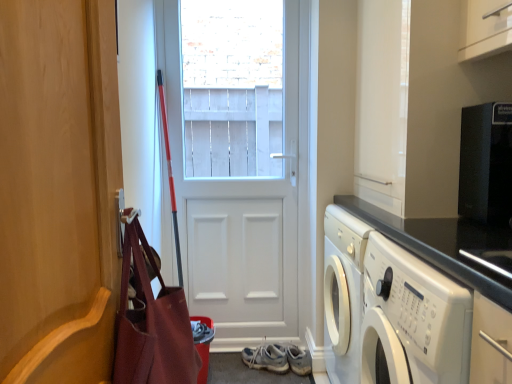
What do you see at coordinates (266, 358) in the screenshot? I see `light blue fabric sneakers at center` at bounding box center [266, 358].

What do you see at coordinates (486, 163) in the screenshot?
I see `black matte microwave at upper right` at bounding box center [486, 163].

I want to click on white glossy washing machine at lower right, so click(x=412, y=320).

Describe the element at coordinates (151, 320) in the screenshot. I see `leather-like brown bag at left` at that location.

Find the location of a particular element. The image size is (512, 384). light blue fabric sneakers at center is located at coordinates (266, 358).

Between light blue fabric sneakers at center and black matte microwave at upper right, which one has more height?

black matte microwave at upper right is taller.

Which is more to the left, light blue fabric sneakers at center or black matte microwave at upper right?

light blue fabric sneakers at center.

Which object is further away from the camera, light blue fabric sneakers at center or black matte microwave at upper right?

light blue fabric sneakers at center is further away from the camera.

Is light blue fabric sneakers at center next to black matte microwave at upper right?

light blue fabric sneakers at center is not next to black matte microwave at upper right, and they're not touching.

Is wooden door at left, placed as the 1th door when sorted from front to back, facing towards white glossy washing machine at lower right?

Yes.

Does wooden door at left, positioned as the 2th door in back-to-front order, appear on the left side of white glossy washing machine at lower right?

Indeed, wooden door at left, positioned as the 2th door in back-to-front order, is positioned on the left side of white glossy washing machine at lower right.

Is wooden door at left, positioned as the 2th door in back-to-front order, not near white glossy washing machine at lower right?

No, wooden door at left, positioned as the 2th door in back-to-front order, is not far away from white glossy washing machine at lower right.

From a real-world perspective, is leather-like brown bag at left positioned under white matte door at center, the 1th door in the back-to-front sequence, based on gravity?

Yes, from a real-world perspective, leather-like brown bag at left is below white matte door at center, the 1th door in the back-to-front sequence.

Between leather-like brown bag at left and white matte door at center, the 1th door in the back-to-front sequence, which one appears on the left side from the viewer's perspective?

Positioned to the left is leather-like brown bag at left.

From the image's perspective, which one is positioned higher, leather-like brown bag at left or white matte door at center, the 1th door in the back-to-front sequence?

white matte door at center, the 1th door in the back-to-front sequence, from the image's perspective.

Which of these two, white glossy washing machine at lower right or leather-like brown bag at left, stands taller?

Standing taller between the two is white glossy washing machine at lower right.

From the image's perspective, is white glossy washing machine at lower right located beneath leather-like brown bag at left?

Yes.

Considering the positions of point (460, 348) and point (151, 296), is point (460, 348) closer or farther from the camera than point (151, 296)?

Clearly, point (460, 348) is closer to the camera than point (151, 296).

Where is `bag positioned vertically above the white glossy washing machine at lower right (from a real-world perspective)`? bag positioned vertically above the white glossy washing machine at lower right (from a real-world perspective) is located at coordinates (151, 320).

This screenshot has width=512, height=384. Find the location of `washing machine in front of the white matte door at center, the 1th door in the back-to-front sequence`. washing machine in front of the white matte door at center, the 1th door in the back-to-front sequence is located at coordinates (412, 320).

Is white glossy washing machine at lower right smaller than white matte door at center, the 1th door in the back-to-front sequence?

Indeed, white glossy washing machine at lower right has a smaller size compared to white matte door at center, the 1th door in the back-to-front sequence.

Between white glossy washing machine at lower right and white matte door at center, acting as the 2th door starting from the front, which one has less height?

With less height is white glossy washing machine at lower right.

From the image's perspective, is white glossy washing machine at lower right below white matte door at center, acting as the 2th door starting from the front?

Correct, white glossy washing machine at lower right appears lower than white matte door at center, acting as the 2th door starting from the front, in the image.

From the image's perspective, is wooden door at left, placed as the 1th door when sorted from front to back, positioned above or below leather-like brown bag at left?

wooden door at left, placed as the 1th door when sorted from front to back, is above leather-like brown bag at left.

Can you confirm if wooden door at left, positioned as the 2th door in back-to-front order, is positioned to the right of leather-like brown bag at left?

No, wooden door at left, positioned as the 2th door in back-to-front order, is not to the right of leather-like brown bag at left.

Is wooden door at left, positioned as the 2th door in back-to-front order, turned away from leather-like brown bag at left?

No, wooden door at left, positioned as the 2th door in back-to-front order,'s orientation is not away from leather-like brown bag at left.

Considering the sizes of leather-like brown bag at left and black matte microwave at upper right in the image, is leather-like brown bag at left bigger or smaller than black matte microwave at upper right?

Considering their sizes, leather-like brown bag at left takes up more space than black matte microwave at upper right.

Between leather-like brown bag at left and black matte microwave at upper right, which one has smaller width?

leather-like brown bag at left.

Considering the relative positions of leather-like brown bag at left and black matte microwave at upper right in the image provided, is leather-like brown bag at left to the right of black matte microwave at upper right from the viewer's perspective?

Incorrect, leather-like brown bag at left is not on the right side of black matte microwave at upper right.

How many degrees apart are the facing directions of leather-like brown bag at left and black matte microwave at upper right?

The angular difference between leather-like brown bag at left and black matte microwave at upper right is 179 degrees.

Identify the location of appliance above the light blue fabric sneakers at center (from the image's perspective). (486, 163).

Identify the location of washing machine that appears below the wooden door at left, placed as the 1th door when sorted from front to back (from the image's perspective). This screenshot has width=512, height=384. (412, 320).

Based on the photo, based on their spatial positions, is white glossy washing machine at lower right or leather-like brown bag at left further from wooden door at left, placed as the 1th door when sorted from front to back?

white glossy washing machine at lower right lies further to wooden door at left, placed as the 1th door when sorted from front to back, than the other object.

Based on their spatial positions, is black matte microwave at upper right or leather-like brown bag at left further from white matte door at center, acting as the 2th door starting from the front?

leather-like brown bag at left.

From the image, which object appears to be nearer to leather-like brown bag at left, white glossy washing machine at lower right or light blue fabric sneakers at center?

Among the two, white glossy washing machine at lower right is located nearer to leather-like brown bag at left.

Looking at the image, which one is located further to leather-like brown bag at left, black matte microwave at upper right or light blue fabric sneakers at center?

Based on the image, light blue fabric sneakers at center appears to be further to leather-like brown bag at left.

When comparing their distances from wooden door at left, placed as the 1th door when sorted from front to back, does white matte door at center, the 1th door in the back-to-front sequence, or black matte microwave at upper right seem closer?

Among the two, black matte microwave at upper right is located nearer to wooden door at left, placed as the 1th door when sorted from front to back.

Based on their spatial positions, is black matte microwave at upper right or white glossy washing machine at lower right further from light blue fabric sneakers at center?

Among the two, black matte microwave at upper right is located further to light blue fabric sneakers at center.

When comparing their distances from black matte microwave at upper right, does white matte door at center, the 1th door in the back-to-front sequence, or wooden door at left, placed as the 1th door when sorted from front to back, seem closer?

wooden door at left, placed as the 1th door when sorted from front to back, lies closer to black matte microwave at upper right than the other object.

When comparing their distances from white glossy washing machine at lower right, does light blue fabric sneakers at center or black matte microwave at upper right seem further?

light blue fabric sneakers at center lies further to white glossy washing machine at lower right than the other object.

At what (x,y) coordinates should I click in order to perform the action: click on washing machine located between wooden door at left, placed as the 1th door when sorted from front to back, and light blue fabric sneakers at center in the depth direction. Please return your answer as a coordinate pair (x, y). This screenshot has width=512, height=384. Looking at the image, I should click on (412, 320).

Where is `appliance between leather-like brown bag at left and white matte door at center, the 1th door in the back-to-front sequence, along the z-axis`? The image size is (512, 384). appliance between leather-like brown bag at left and white matte door at center, the 1th door in the back-to-front sequence, along the z-axis is located at coordinates (486, 163).

At what (x,y) coordinates should I click in order to perform the action: click on bag situated between wooden door at left, placed as the 1th door when sorted from front to back, and black matte microwave at upper right from left to right. Please return your answer as a coordinate pair (x, y). Looking at the image, I should click on (151, 320).

Locate an element on the screen. footwear positioned between leather-like brown bag at left and white matte door at center, the 1th door in the back-to-front sequence, from near to far is located at coordinates (266, 358).